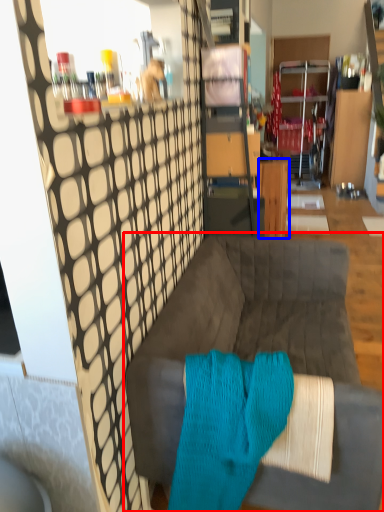
Question: Which object appears farthest to the camera in this image, studio couch (highlighted by a red box) or table (highlighted by a blue box)?

Choices:
 (A) studio couch
 (B) table

Answer: (B)